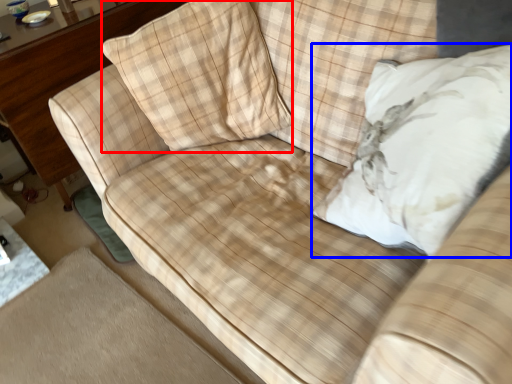
Question: Which object appears farthest to the camera in this image, throw pillow (highlighted by a red box) or throw pillow (highlighted by a blue box)?

Choices:
 (A) throw pillow
 (B) throw pillow

Answer: (A)